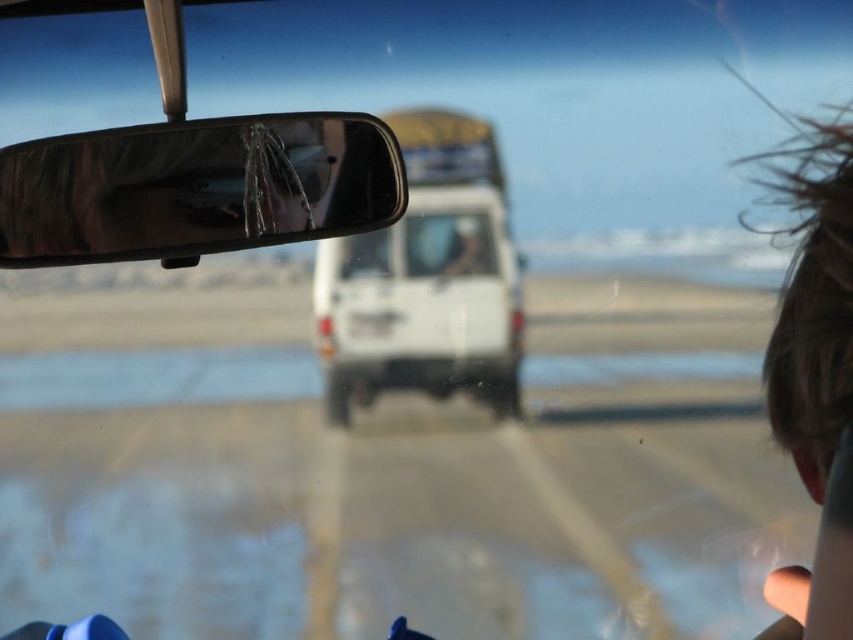
Is shiny chrome mirror at upper center bigger than brown hair at upper right?

No, shiny chrome mirror at upper center is not bigger than brown hair at upper right.

Is shiny chrome mirror at upper center shorter than brown hair at upper right?

Yes.

Who is more forward, (x=364, y=124) or (x=811, y=342)?

Point (x=811, y=342) is more forward.

Locate an element on the screen. shiny chrome mirror at upper center is located at coordinates (196, 188).

Can you confirm if white matte van at center is positioned to the left of brown hair at upper right?

Indeed, white matte van at center is positioned on the left side of brown hair at upper right.

Does white matte van at center have a lesser height compared to brown hair at upper right?

Yes, white matte van at center is shorter than brown hair at upper right.

Locate an element on the screen. white matte van at center is located at coordinates [426, 280].

At what (x,y) coordinates should I click in order to perform the action: click on white matte van at center. Please return your answer as a coordinate pair (x, y). Image resolution: width=853 pixels, height=640 pixels. Looking at the image, I should click on (426, 280).

Is brown hair at upper right thinner than transparent glass car window at center?

In fact, brown hair at upper right might be wider than transparent glass car window at center.

Is brown hair at upper right closer to the viewer compared to transparent glass car window at center?

Yes, it is in front of transparent glass car window at center.

Locate an element on the screen. brown hair at upper right is located at coordinates (816, 368).